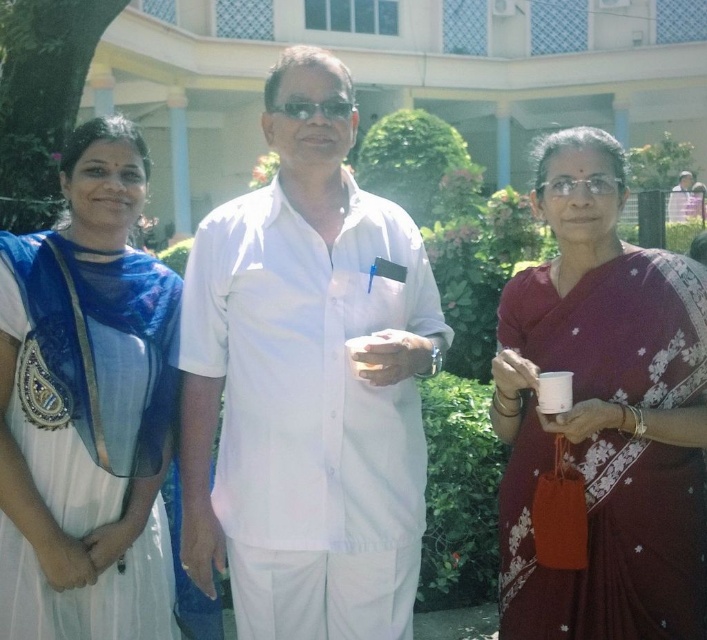
You are a photographer planning to take a group photo of the three people in the scene. You want to arrange them so that the maroon silk saree at right and the white silk saree at left are both visible in the frame. Based on their current positions, which saree will appear lower in the photo?

The maroon silk saree at right is below the white silk saree at left, so in the photo, the maroon silk saree at right will appear lower than the white silk saree at left.

You are organizing a photo shoot and need to ensure that all participants are visible in the frame. Given the sizes of the white matte shirt at center and the white silk saree at left, which one might require more space to accommodate in the photo?

The white matte shirt at center is bigger than the white silk saree at left, so it would require more space to accommodate in the photo.